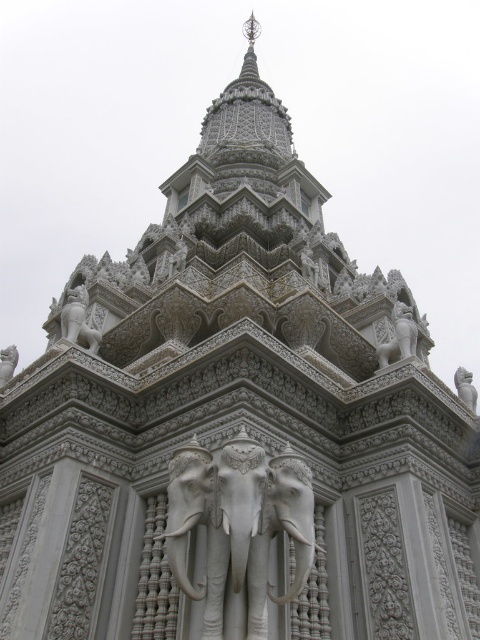
Does white stone lion at upper right have a lesser height compared to white stone elephant at lower left?

No, white stone lion at upper right is not shorter than white stone elephant at lower left.

Which is behind, point (458, 365) or point (8, 348)?

The point (458, 365) is behind.

Is point (466, 404) positioned behind point (11, 369)?

No.

This screenshot has height=640, width=480. Identify the location of white stone lion at upper right. (466, 387).

In the scene shown: Can you confirm if white stone elephants at center is positioned to the left of white stone lion at upper left?

Incorrect, white stone elephants at center is not on the left side of white stone lion at upper left.

Does white stone elephants at center appear over white stone lion at upper left?

No.

Where is `white stone elephants at center`? The image size is (480, 640). white stone elephants at center is located at coordinates (239, 524).

Can you confirm if white stone lion at upper left is wider than white stone elephant at lower left?

Yes.

Is white stone lion at upper left bigger than white stone elephant at lower left?

Correct, white stone lion at upper left is larger in size than white stone elephant at lower left.

Which is in front, point (96, 337) or point (14, 346)?

Point (96, 337)

The width and height of the screenshot is (480, 640). I want to click on white stone lion at upper left, so click(x=79, y=320).